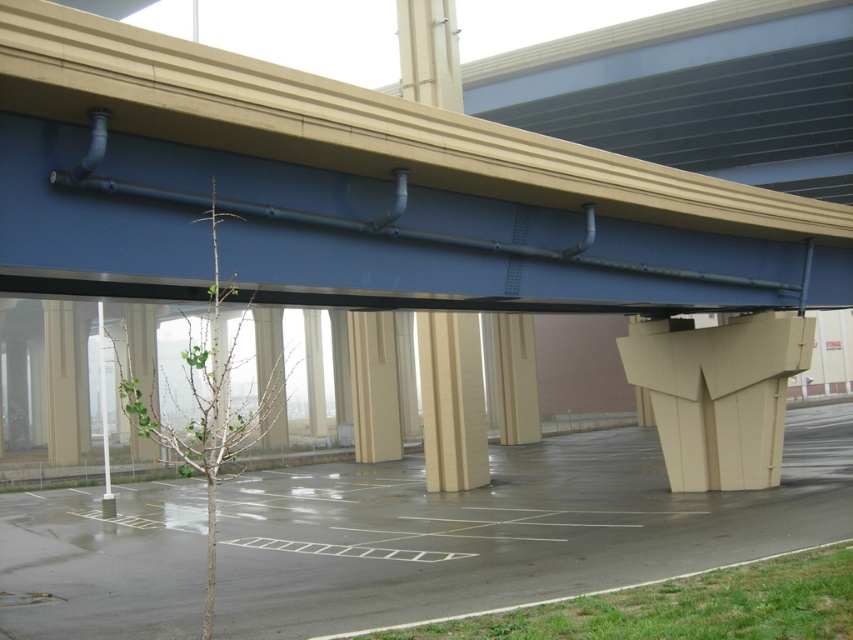
Between smooth concrete overpass at center and beige textured column at center, which one has more height?

Standing taller between the two is beige textured column at center.

Does smooth concrete overpass at center appear on the left side of beige textured column at center?

No, smooth concrete overpass at center is not to the left of beige textured column at center.

Between point (376, 296) and point (424, 355), which one is positioned in front?

Point (376, 296)

Identify the location of smooth concrete overpass at center. (355, 193).

Does smooth concrete overpass at center have a smaller size compared to beige concrete pillar at center?

Correct, smooth concrete overpass at center occupies less space than beige concrete pillar at center.

Is smooth concrete overpass at center shorter than beige concrete pillar at center?

Yes, smooth concrete overpass at center is shorter than beige concrete pillar at center.

Is point (575, 284) behind point (498, 420)?

No, (575, 284) is in front of (498, 420).

Where is `smooth concrete overpass at center`? smooth concrete overpass at center is located at coordinates (355, 193).

Does smooth concrete overpass at center lie in front of smooth asphalt parking lot at center?

Yes.

Can you confirm if smooth concrete overpass at center is bigger than smooth asphalt parking lot at center?

Actually, smooth concrete overpass at center might be smaller than smooth asphalt parking lot at center.

Is point (415, 262) behind point (320, 468)?

That is False.

This screenshot has width=853, height=640. Identify the location of smooth concrete overpass at center. (355, 193).